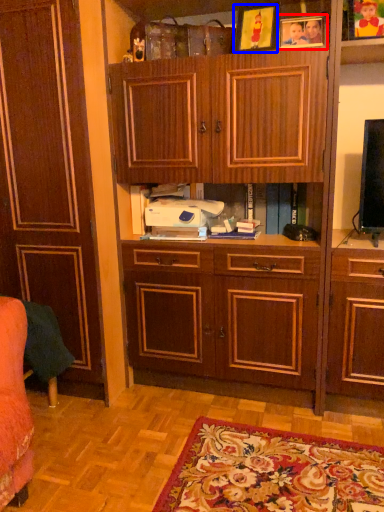
Question: Which object appears closest to the camera in this image, picture frame (highlighted by a red box) or picture frame (highlighted by a blue box)?

Choices:
 (A) picture frame
 (B) picture frame

Answer: (B)